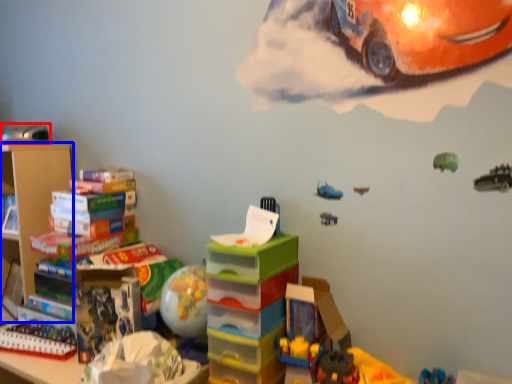
Question: Which of the following is the closest to the observer, toy (highlighted by a red box) or shelf (highlighted by a blue box)?

Choices:
 (A) toy
 (B) shelf

Answer: (B)